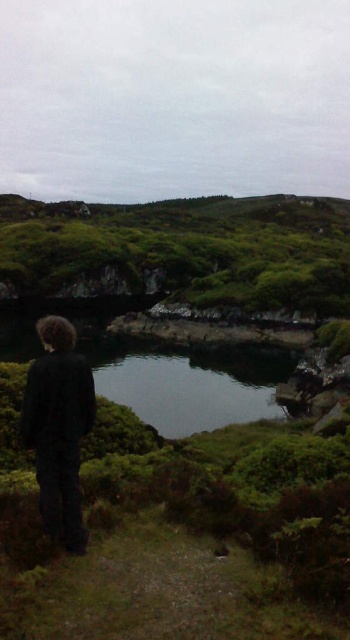
Question: Does clear water at center have a larger size compared to black matte jacket at center?

Choices:
 (A) yes
 (B) no

Answer: (A)

Question: Which point appears farthest from the camera in this image?

Choices:
 (A) (72, 545)
 (B) (103, 364)

Answer: (B)

Question: Can you confirm if clear water at center is positioned to the right of black matte jacket at center?

Choices:
 (A) no
 (B) yes

Answer: (B)

Question: Does clear water at center have a smaller size compared to black matte jacket at center?

Choices:
 (A) yes
 (B) no

Answer: (B)

Question: Which point appears farthest from the camera in this image?

Choices:
 (A) (59, 536)
 (B) (192, 372)

Answer: (B)

Question: Which point appears farthest from the camera in this image?

Choices:
 (A) (220, 349)
 (B) (54, 392)

Answer: (A)